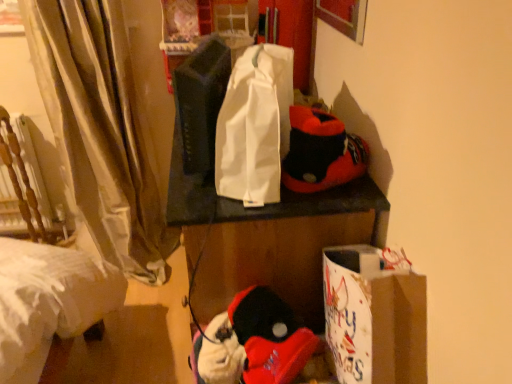
Question: Considering the positions of white fabric tote bag at center and soft plush slippers at upper right, the first twin when ordered from right to left, in the image, is white fabric tote bag at center taller or shorter than soft plush slippers at upper right, the first twin when ordered from right to left,?

Choices:
 (A) short
 (B) tall

Answer: (B)

Question: Considering the positions of point (234, 145) and point (308, 172), is point (234, 145) closer or farther from the camera than point (308, 172)?

Choices:
 (A) closer
 (B) farther

Answer: (A)

Question: Which is farther from the soft plush toy at lower center, the second toy when ordered from left to right?

Choices:
 (A) wooden armchair at left
 (B) soft plush slippers at upper right, acting as the second twin starting from the left
 (C) silky beige curtain at left
 (D) matte black speaker at center, marked as the first twin in a left-to-right arrangement
 (E) white fabric tote bag at center

Answer: (A)

Question: Which is farther from the wooden armchair at left?

Choices:
 (A) white fabric tote bag at center
 (B) silky beige curtain at left
 (C) matte black speaker at center, marked as the first twin in a left-to-right arrangement
 (D) white paper bag at lower right
 (E) soft plush toy at lower center, the second toy when ordered from left to right

Answer: (D)